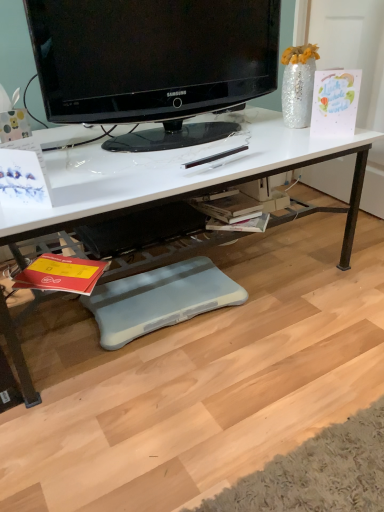
Question: Is the position of blue foam footrest at lower center less distant than that of black glossy television at upper center?

Choices:
 (A) yes
 (B) no

Answer: (B)

Question: Does blue foam footrest at lower center appear on the right side of black glossy television at upper center?

Choices:
 (A) no
 (B) yes

Answer: (A)

Question: Is blue foam footrest at lower center facing away from black glossy television at upper center?

Choices:
 (A) yes
 (B) no

Answer: (B)

Question: Is blue foam footrest at lower center thinner than black glossy television at upper center?

Choices:
 (A) yes
 (B) no

Answer: (B)

Question: Would you consider blue foam footrest at lower center to be distant from black glossy television at upper center?

Choices:
 (A) yes
 (B) no

Answer: (B)

Question: Based on their positions, is white glossy desk at center located to the left or right of blue foam footrest at lower center?

Choices:
 (A) right
 (B) left

Answer: (B)

Question: Choose the correct answer: Is white glossy desk at center inside blue foam footrest at lower center or outside it?

Choices:
 (A) outside
 (B) inside

Answer: (A)

Question: Is white glossy desk at center in front of or behind blue foam footrest at lower center in the image?

Choices:
 (A) front
 (B) behind

Answer: (A)

Question: From their relative heights in the image, would you say white glossy desk at center is taller or shorter than blue foam footrest at lower center?

Choices:
 (A) tall
 (B) short

Answer: (A)

Question: From a real-world perspective, is white glossy desk at center above or below black glossy television at upper center?

Choices:
 (A) above
 (B) below

Answer: (B)

Question: Do you think white glossy desk at center is within black glossy television at upper center, or outside of it?

Choices:
 (A) outside
 (B) inside

Answer: (A)

Question: From their relative heights in the image, would you say white glossy desk at center is taller or shorter than black glossy television at upper center?

Choices:
 (A) short
 (B) tall

Answer: (B)

Question: Is point (339, 139) positioned closer to the camera than point (241, 0)?

Choices:
 (A) closer
 (B) farther

Answer: (A)

Question: Is point (192, 72) positioned closer to the camera than point (228, 296)?

Choices:
 (A) farther
 (B) closer

Answer: (B)

Question: Considering the positions of black glossy television at upper center and blue foam footrest at lower center in the image, is black glossy television at upper center bigger or smaller than blue foam footrest at lower center?

Choices:
 (A) small
 (B) big

Answer: (B)